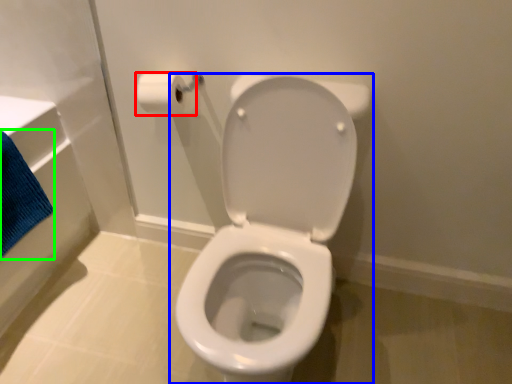
Question: Which object is positioned closest to toilet paper (highlighted by a red box)? Select from toilet (highlighted by a blue box) and bath towel (highlighted by a green box).

Choices:
 (A) toilet
 (B) bath towel

Answer: (A)